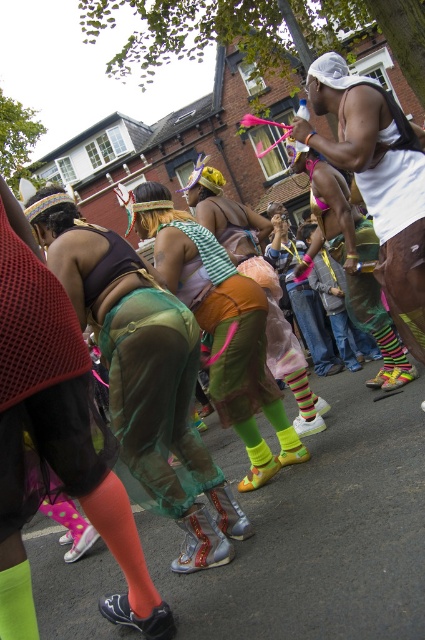
Who is taller, green mesh skirt at center or white matte tank top at upper right?

white matte tank top at upper right

Can you confirm if green mesh skirt at center is positioned to the right of white matte tank top at upper right?

No, green mesh skirt at center is not to the right of white matte tank top at upper right.

Which is behind, point (170, 324) or point (413, 141)?

Point (413, 141)

Image resolution: width=425 pixels, height=640 pixels. I want to click on green mesh skirt at center, so pyautogui.click(x=144, y=376).

Looking at this image, who is taller, green mesh skirt at center or green mesh dress at center?

Standing taller between the two is green mesh skirt at center.

Can you confirm if green mesh skirt at center is positioned to the left of green mesh dress at center?

Correct, you'll find green mesh skirt at center to the left of green mesh dress at center.

The image size is (425, 640). In order to click on green mesh skirt at center in this screenshot , I will do `click(144, 376)`.

Who is higher up, green mesh dress at center or white matte tank top at upper right?

Positioned higher is white matte tank top at upper right.

Which of these two, green mesh dress at center or white matte tank top at upper right, stands shorter?

green mesh dress at center is shorter.

Measure the distance between point (238, 330) and camera.

The distance of point (238, 330) from camera is 14.60 feet.

In order to click on green mesh dress at center in this screenshot , I will do `click(220, 324)`.